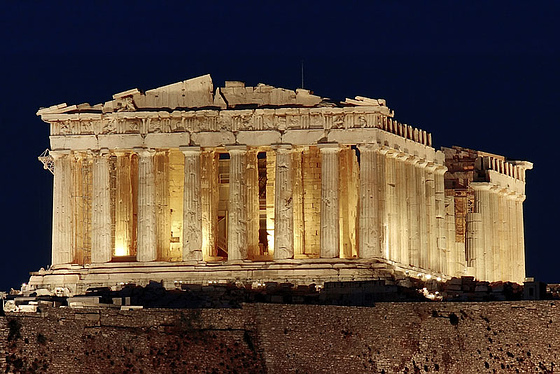
Identify the location of columns. pyautogui.click(x=67, y=198), pyautogui.click(x=107, y=198), pyautogui.click(x=133, y=199), pyautogui.click(x=199, y=206), pyautogui.click(x=231, y=203), pyautogui.click(x=284, y=201), pyautogui.click(x=331, y=202).